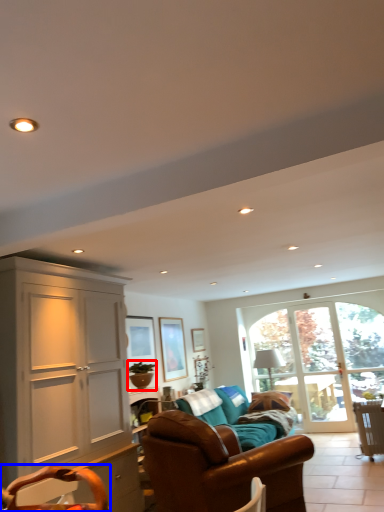
Question: Which object is closer to the camera taking this photo, houseplant (highlighted by a red box) or swivel chair (highlighted by a blue box)?

Choices:
 (A) houseplant
 (B) swivel chair

Answer: (B)